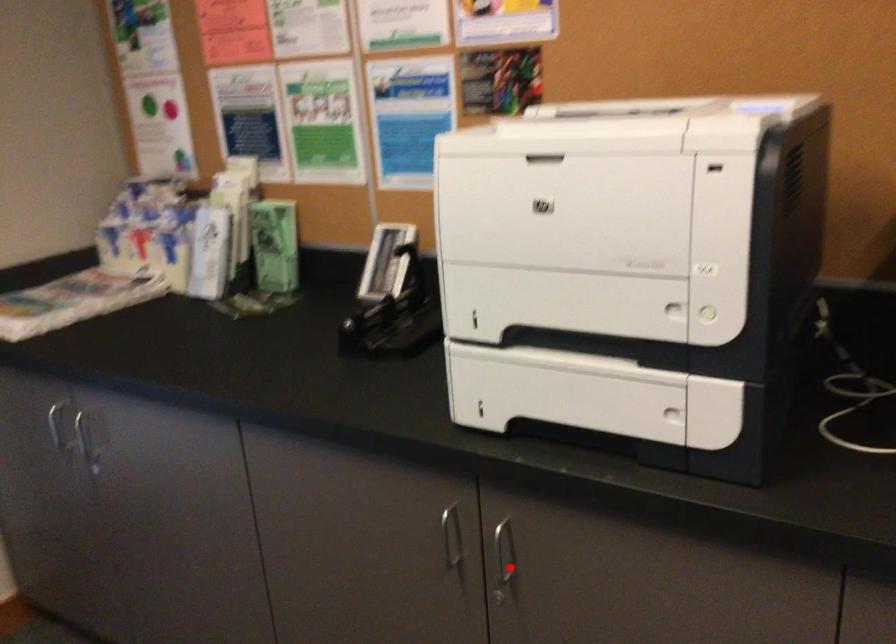
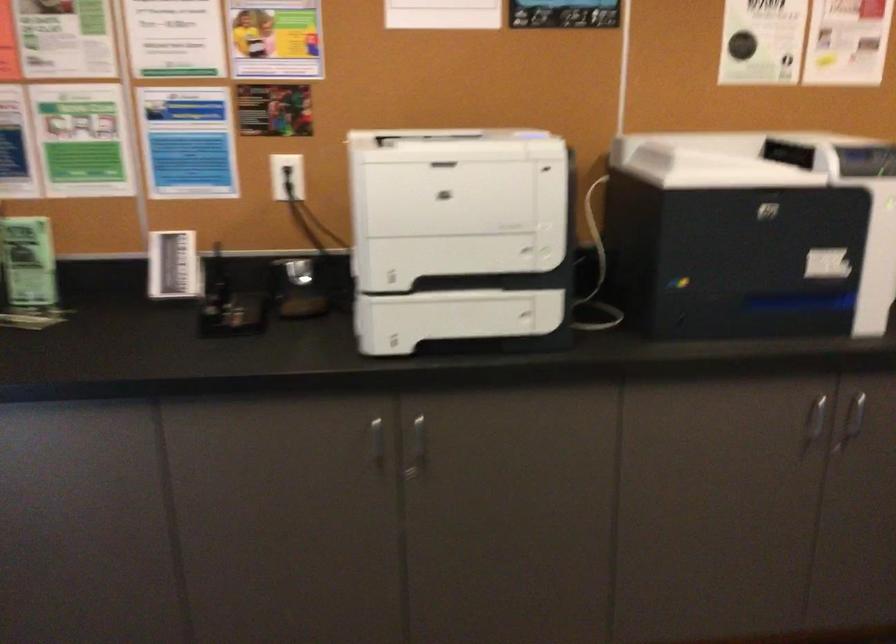
The point at the highlighted location is marked in the first image. Where is the corresponding point in the second image?

(417, 448)